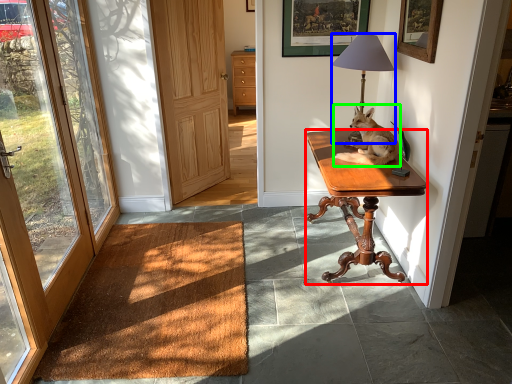
Question: Which object is positioned closest to desk (highlighted by a red box)? Select from lamp (highlighted by a blue box) and dog (highlighted by a green box).

Choices:
 (A) lamp
 (B) dog

Answer: (B)